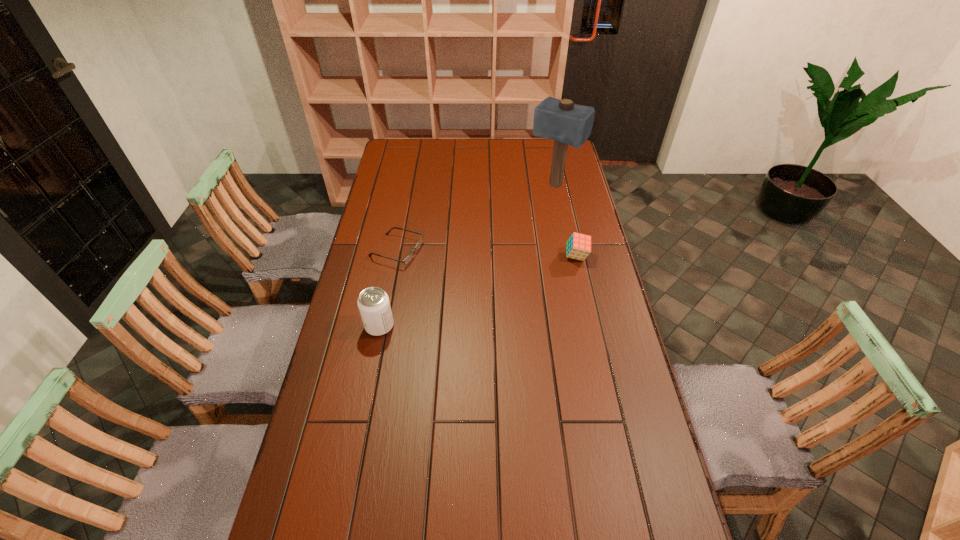
In order to click on blank space located on the front-facing side of the shortest object in this screenshot , I will do `click(503, 279)`.

The image size is (960, 540). Identify the location of vacant space located 0.210m on the striking surface of the mallet. (520, 224).

The image size is (960, 540). Identify the location of vacant space located on the striking surface of the mallet. (511, 234).

Locate an element on the screen. The width and height of the screenshot is (960, 540). free space located on the striking surface of the mallet is located at coordinates (519, 225).

Locate an element on the screen. The width and height of the screenshot is (960, 540). soda can at the left edge is located at coordinates (373, 303).

What are the coordinates of `spectacles present at the left edge` in the screenshot? It's located at (410, 256).

Image resolution: width=960 pixels, height=540 pixels. I want to click on cube present at the right edge, so click(578, 247).

I want to click on mallet present at the right edge, so click(566, 123).

In the image, there is a desktop. Where is `vacant space at the far edge`? vacant space at the far edge is located at coordinates (467, 148).

You are a GUI agent. You are given a task and a screenshot of the screen. Output one action in this format:
    pyautogui.click(x=<x>, y=<y>)
    Task: Click on the free space at the near edge
    
    Given the screenshot: What is the action you would take?
    pyautogui.click(x=420, y=509)